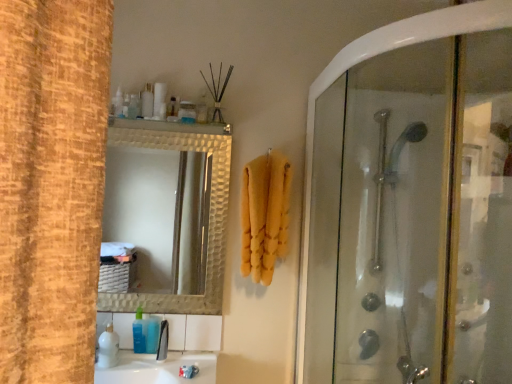
I want to click on white glossy soap at upper center, marked as the 1th toiletry in a top-to-bottom arrangement, so coord(187,112).

From the image's perspective, is black plastic faucet at lower center positioned above or below white glossy sink at lower center?

black plastic faucet at lower center is above white glossy sink at lower center.

Can you confirm if black plastic faucet at lower center is smaller than white glossy sink at lower center?

Indeed, black plastic faucet at lower center has a smaller size compared to white glossy sink at lower center.

Looking at this image, can you see black plastic faucet at lower center touching white glossy sink at lower center?

No, black plastic faucet at lower center is not beside white glossy sink at lower center.

From a real-world perspective, between black plastic faucet at lower center and white glossy sink at lower center, who is vertically lower?

From a 3D spatial view, white glossy sink at lower center is below.

Considering the positions of objects blue translucent soap at lower center, acting as the 2th toiletry starting from the top, and transparent glass shower door at right in the image provided, who is more to the right, blue translucent soap at lower center, acting as the 2th toiletry starting from the top, or transparent glass shower door at right?

Positioned to the right is transparent glass shower door at right.

Based on their sizes in the image, would you say blue translucent soap at lower center, which ranks as the 1th toiletry in left-to-right order, is bigger or smaller than transparent glass shower door at right?

In the image, blue translucent soap at lower center, which ranks as the 1th toiletry in left-to-right order, appears to be smaller than transparent glass shower door at right.

Looking at this image, is blue translucent soap at lower center, the 2th toiletry viewed from the right, with transparent glass shower door at right?

No, blue translucent soap at lower center, the 2th toiletry viewed from the right, is not in contact with transparent glass shower door at right.

From the image's perspective, is blue translucent soap at lower center, the 2th toiletry viewed from the right, located beneath transparent glass shower door at right?

Yes, from the image's perspective, blue translucent soap at lower center, the 2th toiletry viewed from the right, is below transparent glass shower door at right.

Between transparent glass shower door at right and blue translucent soap at lower center, acting as the 2th toiletry starting from the top, which one appears on the left side from the viewer's perspective?

From the viewer's perspective, blue translucent soap at lower center, acting as the 2th toiletry starting from the top, appears more on the left side.

Is transparent glass shower door at right turned away from blue translucent soap at lower center, which ranks as the 1th toiletry in left-to-right order?

No, transparent glass shower door at right's orientation is not away from blue translucent soap at lower center, which ranks as the 1th toiletry in left-to-right order.

Find the location of a particular element. Image resolution: width=512 pixels, height=384 pixels. toiletry that is the 2nd object located behind the transparent glass shower door at right is located at coordinates (152, 334).

From a real-world perspective, is transparent glass shower door at right on top of blue translucent soap at lower center, acting as the 2th toiletry starting from the top?

Correct, in the physical world, transparent glass shower door at right is higher than blue translucent soap at lower center, acting as the 2th toiletry starting from the top.

Identify the location of toiletry below the white glossy soap at upper center, which is counted as the second toiletry, starting from the bottom (from a real-world perspective). (152, 334).

Who is more distant, blue translucent soap at lower center, acting as the 2th toiletry starting from the top, or white glossy soap at upper center, the 1th toiletry viewed from the right?

Positioned behind is blue translucent soap at lower center, acting as the 2th toiletry starting from the top.

Based on the photo, is blue translucent soap at lower center, acting as the 2th toiletry starting from the top, wider or thinner than white glossy soap at upper center, the 1th toiletry viewed from the right?

In the image, blue translucent soap at lower center, acting as the 2th toiletry starting from the top, appears to be more narrow than white glossy soap at upper center, the 1th toiletry viewed from the right.

Considering the sizes of objects black plastic faucet at lower center and yellow fluffy towel at center in the image provided, who is shorter, black plastic faucet at lower center or yellow fluffy towel at center?

With less height is black plastic faucet at lower center.

Considering the relative sizes of black plastic faucet at lower center and yellow fluffy towel at center in the image provided, is black plastic faucet at lower center bigger than yellow fluffy towel at center?

Incorrect, black plastic faucet at lower center is not larger than yellow fluffy towel at center.

Where is `faucet located on the left of yellow fluffy towel at center`? This screenshot has height=384, width=512. faucet located on the left of yellow fluffy towel at center is located at coordinates (163, 341).

From a real-world perspective, is black plastic faucet at lower center under yellow fluffy towel at center?

Yes, from a real-world perspective, black plastic faucet at lower center is beneath yellow fluffy towel at center.

Who is smaller, yellow fluffy towel at center or transparent glass shower door at right?

Smaller between the two is yellow fluffy towel at center.

From the image's perspective, is yellow fluffy towel at center above or below transparent glass shower door at right?

Clearly, from the image's perspective, yellow fluffy towel at center is above transparent glass shower door at right.

Is yellow fluffy towel at center oriented away from transparent glass shower door at right?

No.

Is transparent glass shower door at right looking in the opposite direction of black plastic faucet at lower center?

No.

From a real-world perspective, is transparent glass shower door at right below black plastic faucet at lower center?

No, from a real-world perspective, transparent glass shower door at right is not under black plastic faucet at lower center.

Is transparent glass shower door at right inside or outside of black plastic faucet at lower center?

transparent glass shower door at right exists outside the volume of black plastic faucet at lower center.

Where is `sink to the right of black plastic faucet at lower center`? This screenshot has height=384, width=512. sink to the right of black plastic faucet at lower center is located at coordinates (168, 352).

What are the coordinates of `toiletry below the transparent glass shower door at right (from the image's perspective)` in the screenshot? It's located at (152, 334).

Considering their positions, is yellow fluffy towel at center positioned closer to black plastic faucet at lower center than transparent glass shower door at right?

yellow fluffy towel at center is positioned closer to the anchor black plastic faucet at lower center.

Looking at the image, which one is located further to white glossy sink at lower center, black plastic faucet at lower center or white glossy soap at upper center, the 1th toiletry viewed from the right?

white glossy soap at upper center, the 1th toiletry viewed from the right, is positioned further to the anchor white glossy sink at lower center.

From the picture: Estimate the real-world distances between objects in this image. Which object is further from blue translucent soap at lower center, acting as the 2th toiletry starting from the top, white glossy soap at upper center, which is counted as the 2th toiletry, starting from the left, or transparent glass shower door at right?

transparent glass shower door at right is positioned further to the anchor blue translucent soap at lower center, acting as the 2th toiletry starting from the top.

Based on their spatial positions, is transparent glass shower door at right or white glossy sink at lower center further from black plastic faucet at lower center?

The object further to black plastic faucet at lower center is transparent glass shower door at right.

Based on their spatial positions, is yellow fluffy towel at center or white glossy sink at lower center closer to black plastic faucet at lower center?

Based on the image, white glossy sink at lower center appears to be nearer to black plastic faucet at lower center.

Considering their positions, is yellow fluffy towel at center positioned further to white glossy soap at upper center, which is counted as the second toiletry, starting from the bottom, than white glossy sink at lower center?

white glossy sink at lower center.

When comparing their distances from white glossy sink at lower center, does white glossy soap at upper center, the 1th toiletry viewed from the right, or transparent glass shower door at right seem closer?

The object closer to white glossy sink at lower center is transparent glass shower door at right.

Which object lies further to the anchor point yellow fluffy towel at center, white glossy sink at lower center or blue translucent soap at lower center, acting as the 2th toiletry starting from the top?

blue translucent soap at lower center, acting as the 2th toiletry starting from the top, lies further to yellow fluffy towel at center than the other object.

Identify the location of bath towel that lies between white glossy soap at upper center, which is counted as the 2th toiletry, starting from the left, and white glossy sink at lower center from top to bottom. The width and height of the screenshot is (512, 384). (264, 215).

Image resolution: width=512 pixels, height=384 pixels. I want to click on toiletry situated between blue translucent soap at lower center, which ranks as the 1th toiletry in left-to-right order, and transparent glass shower door at right from left to right, so click(x=187, y=112).

The height and width of the screenshot is (384, 512). I want to click on toiletry located between white glossy sink at lower center and transparent glass shower door at right in the left-right direction, so click(x=187, y=112).

Where is `toiletry between white glossy soap at upper center, which is counted as the 2th toiletry, starting from the left, and white glossy sink at lower center vertically`? The image size is (512, 384). toiletry between white glossy soap at upper center, which is counted as the 2th toiletry, starting from the left, and white glossy sink at lower center vertically is located at coordinates (152, 334).